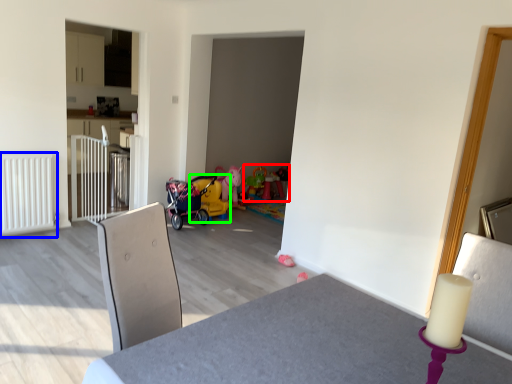
Question: Which object is positioned farthest from toy (highlighted by a red box)? Select from radiator (highlighted by a blue box) and baby carriage (highlighted by a green box).

Choices:
 (A) radiator
 (B) baby carriage

Answer: (A)